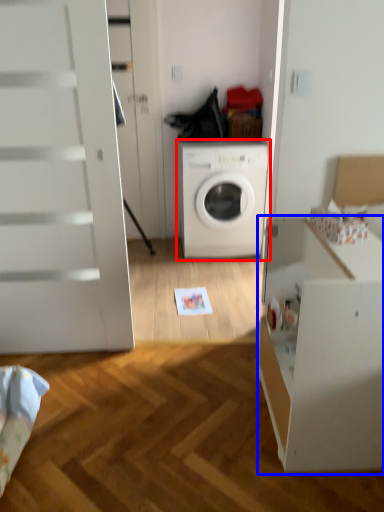
Question: Which point is closer to the camera, washing machine (highlighted by a red box) or file cabinet (highlighted by a blue box)?

Choices:
 (A) washing machine
 (B) file cabinet

Answer: (B)